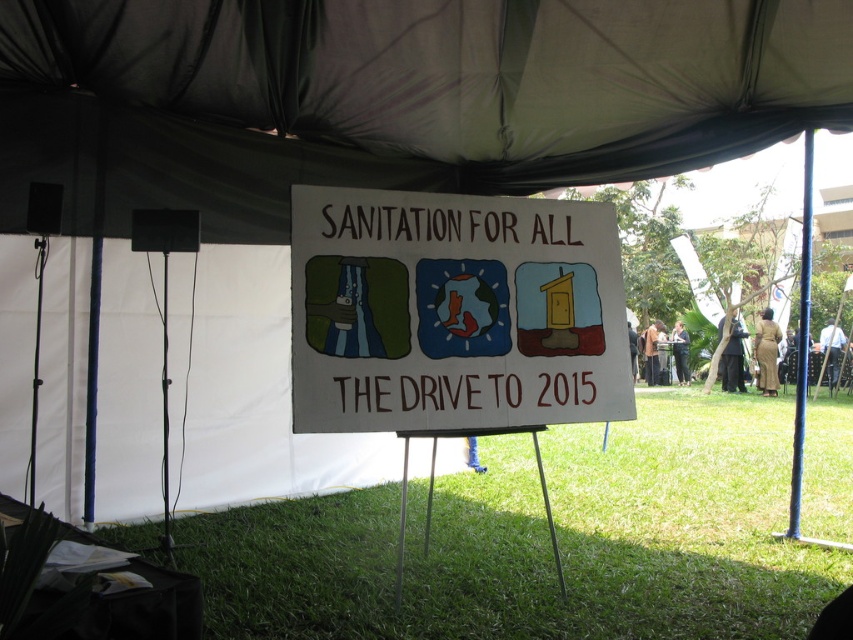
Looking at this image, is green grass at center closer to the viewer compared to white paper sign at center?

Yes, it is in front of white paper sign at center.

Does green grass at center have a larger size compared to white paper sign at center?

Incorrect, green grass at center is not larger than white paper sign at center.

Between point (225, 608) and point (345, 396), which one is positioned in front?

Positioned in front is point (225, 608).

The height and width of the screenshot is (640, 853). In order to click on green grass at center in this screenshot , I will do `click(541, 540)`.

Is point (326, 4) closer to camera compared to point (625, 385)?

No.

Can you confirm if white fabric canopy at upper center is smaller than white paper sign at center?

No, white fabric canopy at upper center is not smaller than white paper sign at center.

The image size is (853, 640). What are the coordinates of `white fabric canopy at upper center` in the screenshot? It's located at (393, 97).

Locate an element on the screen. This screenshot has width=853, height=640. white fabric canopy at upper center is located at coordinates (393, 97).

Does white fabric canopy at upper center have a smaller size compared to green grass at center?

No, white fabric canopy at upper center is not smaller than green grass at center.

This screenshot has height=640, width=853. What are the coordinates of `white fabric canopy at upper center` in the screenshot? It's located at (393, 97).

At what (x,y) coordinates should I click in order to perform the action: click on white fabric canopy at upper center. Please return your answer as a coordinate pair (x, y). Looking at the image, I should click on (393, 97).